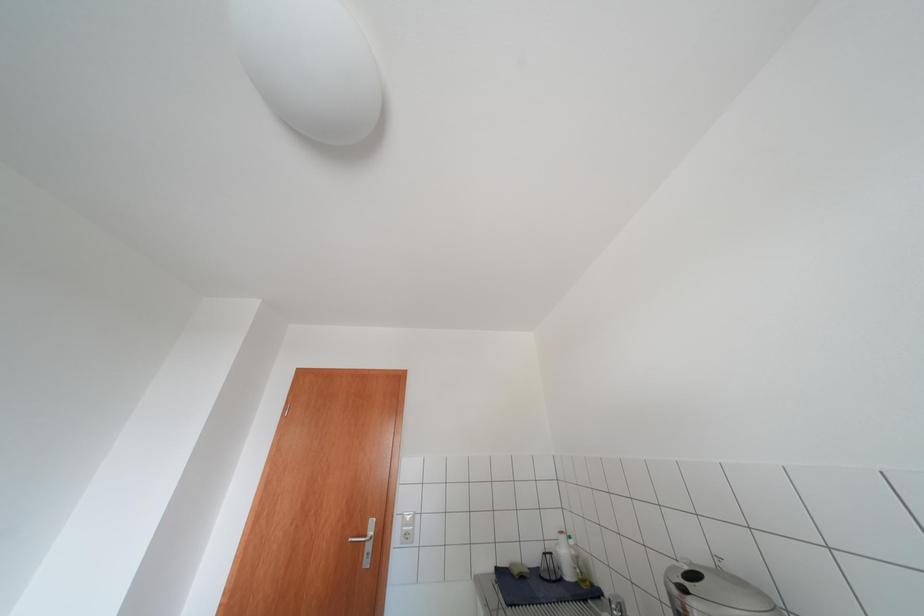
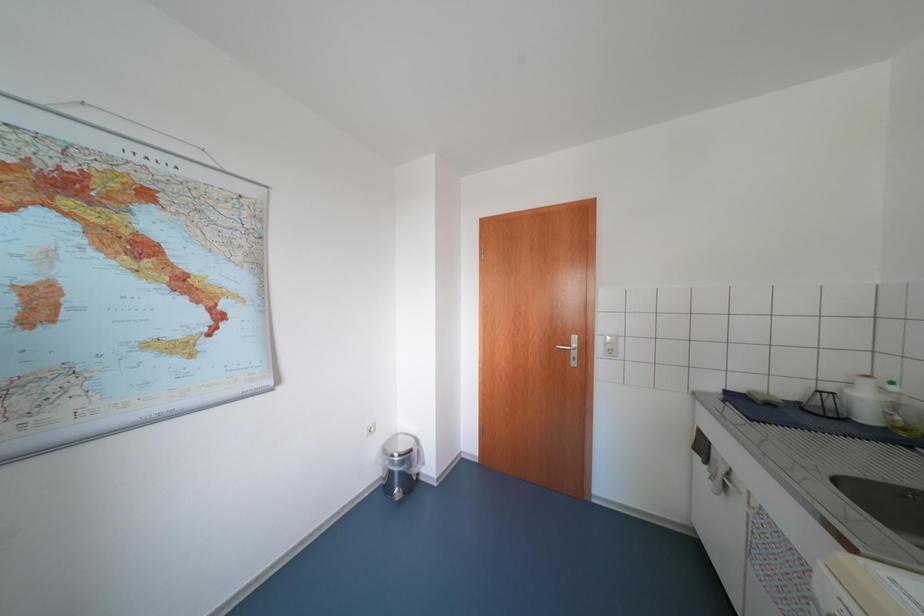
First-person continuous shooting, in which direction is the camera rotating?

The camera's rotation is toward left-down.